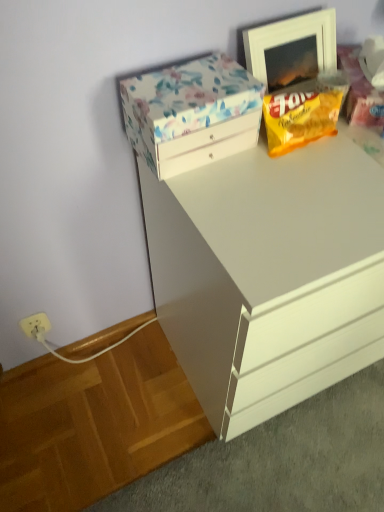
Question: Can you confirm if floral-patterned cardboard box at upper left is smaller than white wooden picture frame at upper right?

Choices:
 (A) no
 (B) yes

Answer: (A)

Question: Does floral-patterned cardboard box at upper left touch white wooden picture frame at upper right?

Choices:
 (A) yes
 (B) no

Answer: (B)

Question: From the image's perspective, is floral-patterned cardboard box at upper left located above white wooden picture frame at upper right?

Choices:
 (A) no
 (B) yes

Answer: (A)

Question: From a real-world perspective, is floral-patterned cardboard box at upper left on top of white wooden picture frame at upper right?

Choices:
 (A) yes
 (B) no

Answer: (B)

Question: From a real-world perspective, is floral-patterned cardboard box at upper left under white wooden picture frame at upper right?

Choices:
 (A) no
 (B) yes

Answer: (B)

Question: Does floral-patterned cardboard box at upper left have a lesser height compared to white wooden picture frame at upper right?

Choices:
 (A) no
 (B) yes

Answer: (B)

Question: Would you say white glossy chest of drawers at upper center is outside yellow matte snack packet at upper right?

Choices:
 (A) no
 (B) yes

Answer: (B)

Question: Would you say white glossy chest of drawers at upper center contains yellow matte snack packet at upper right?

Choices:
 (A) yes
 (B) no

Answer: (B)

Question: Is white glossy chest of drawers at upper center beside yellow matte snack packet at upper right?

Choices:
 (A) no
 (B) yes

Answer: (A)

Question: From the image's perspective, is white glossy chest of drawers at upper center on yellow matte snack packet at upper right?

Choices:
 (A) yes
 (B) no

Answer: (B)

Question: From the image's perspective, is white glossy chest of drawers at upper center beneath yellow matte snack packet at upper right?

Choices:
 (A) no
 (B) yes

Answer: (B)

Question: From a real-world perspective, is white glossy chest of drawers at upper center physically above yellow matte snack packet at upper right?

Choices:
 (A) yes
 (B) no

Answer: (B)

Question: Is yellow matte snack packet at upper right inside floral-patterned cardboard box at upper left?

Choices:
 (A) no
 (B) yes

Answer: (A)